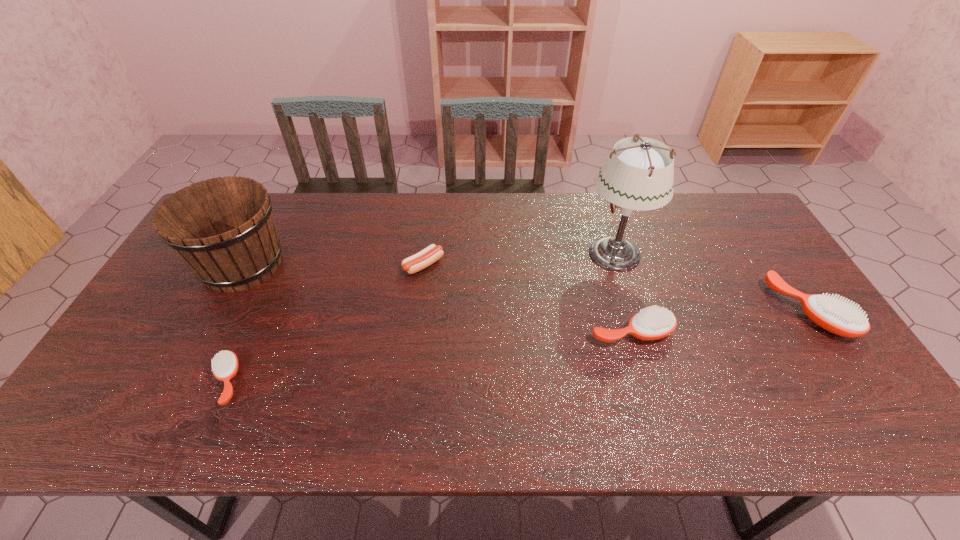
The width and height of the screenshot is (960, 540). Identify the location of empty location between the second tallest object and the rightmost hairbrush. (525, 288).

The height and width of the screenshot is (540, 960). I want to click on vacant space that's between the fourth tallest object and the fourth object from right to left, so click(528, 299).

Image resolution: width=960 pixels, height=540 pixels. I want to click on free spot between the wine bucket and the sausage, so click(x=333, y=265).

Image resolution: width=960 pixels, height=540 pixels. I want to click on free space between the wine bucket and the rightmost hairbrush, so click(525, 288).

Locate an element on the screen. The height and width of the screenshot is (540, 960). free point between the second hairbrush from left to right and the fourth object from right to left is located at coordinates (528, 299).

Find the location of a particular element. blank region between the second shortest hairbrush and the wine bucket is located at coordinates (437, 298).

Identify which object is the closest to the second tallest hairbrush. Please provide its 2D coordinates. Your answer should be formatted as a tuple, i.e. [(x, y)], where the tuple contains the x and y coordinates of a point satisfying the conditions above.

[(639, 175)]

Locate an element on the screen. object that is the second closest to the wine bucket is located at coordinates (419, 261).

Locate an element on the screen. Image resolution: width=960 pixels, height=540 pixels. hairbrush that stands as the third closest to the wine bucket is located at coordinates (837, 316).

Find the location of `hairbrush identified as the third closest to the wine bucket`. hairbrush identified as the third closest to the wine bucket is located at coordinates (837, 316).